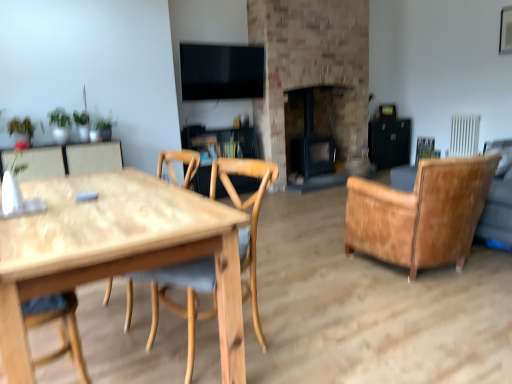
Question: Can you confirm if brick fireplace at center, arranged as the first fireplace when viewed from the right, is shorter than black matte fireplace at center, which ranks as the second fireplace in right-to-left order?

Choices:
 (A) yes
 (B) no

Answer: (B)

Question: Does brick fireplace at center, arranged as the first fireplace when viewed from the right, contain black matte fireplace at center, which ranks as the second fireplace in right-to-left order?

Choices:
 (A) no
 (B) yes

Answer: (B)

Question: Is brick fireplace at center, arranged as the first fireplace when viewed from the right, bigger than black matte fireplace at center, which ranks as the second fireplace in right-to-left order?

Choices:
 (A) yes
 (B) no

Answer: (A)

Question: Does brick fireplace at center, arranged as the 2th fireplace when viewed from the left, have a smaller size compared to black matte fireplace at center, which is the first fireplace from left to right?

Choices:
 (A) no
 (B) yes

Answer: (A)

Question: Is brick fireplace at center, arranged as the first fireplace when viewed from the right, positioned far away from black matte fireplace at center, which is the first fireplace from left to right?

Choices:
 (A) no
 (B) yes

Answer: (A)

Question: From a real-world perspective, is leather armchair at right, which is the second chair from left to right, above or below natural wood table at left?

Choices:
 (A) above
 (B) below

Answer: (A)

Question: In terms of width, does leather armchair at right, the 1th chair viewed from the back, look wider or thinner when compared to natural wood table at left?

Choices:
 (A) thin
 (B) wide

Answer: (B)

Question: Would you say leather armchair at right, the second chair in the front-to-back sequence, is inside or outside natural wood table at left?

Choices:
 (A) inside
 (B) outside

Answer: (B)

Question: Relative to natural wood table at left, is leather armchair at right, the second chair in the front-to-back sequence, in front or behind?

Choices:
 (A) front
 (B) behind

Answer: (B)

Question: From a real-world perspective, is natural wood table at left above or below black matte fireplace at center, which is the first fireplace from left to right?

Choices:
 (A) above
 (B) below

Answer: (B)

Question: Is point (23, 279) closer or farther from the camera than point (289, 147)?

Choices:
 (A) closer
 (B) farther

Answer: (A)

Question: From their relative heights in the image, would you say natural wood table at left is taller or shorter than black matte fireplace at center, which is the first fireplace from left to right?

Choices:
 (A) short
 (B) tall

Answer: (A)

Question: Considering the relative positions of natural wood table at left and black matte fireplace at center, which is the first fireplace from left to right, in the image provided, is natural wood table at left to the left or to the right of black matte fireplace at center, which is the first fireplace from left to right,?

Choices:
 (A) right
 (B) left

Answer: (B)

Question: Considering the positions of point (211, 172) and point (284, 99), is point (211, 172) closer or farther from the camera than point (284, 99)?

Choices:
 (A) closer
 (B) farther

Answer: (A)

Question: Considering the positions of natural wood chair at center, positioned as the 2th chair in right-to-left order, and brick fireplace at center, arranged as the first fireplace when viewed from the right, in the image, is natural wood chair at center, positioned as the 2th chair in right-to-left order, bigger or smaller than brick fireplace at center, arranged as the first fireplace when viewed from the right,?

Choices:
 (A) small
 (B) big

Answer: (A)